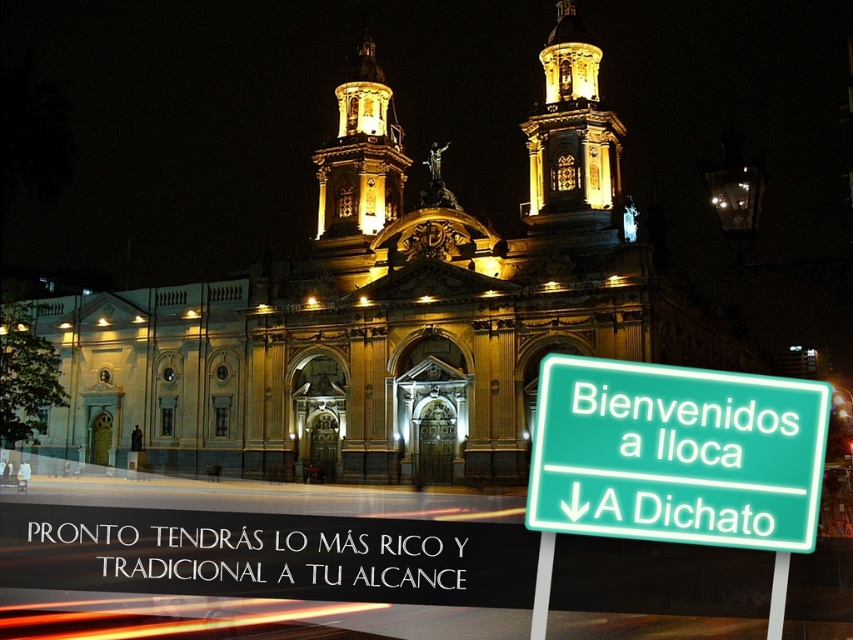
Is green fluorescent sign at lower right thinner than green plastic signpost at lower right?

No, green fluorescent sign at lower right is not thinner than green plastic signpost at lower right.

Which is in front, point (759, 404) or point (538, 552)?

Point (759, 404) is more forward.

Where is `green fluorescent sign at lower right`? green fluorescent sign at lower right is located at coordinates (676, 454).

Can you confirm if green fluorescent sign at lower right is thinner than metallic pole at lower right?

No, green fluorescent sign at lower right is not thinner than metallic pole at lower right.

Which of these two, green fluorescent sign at lower right or metallic pole at lower right, stands taller?

metallic pole at lower right

This screenshot has height=640, width=853. Identify the location of green fluorescent sign at lower right. (676, 454).

Is green plastic signpost at lower right shorter than metallic pole at lower right?

Yes, green plastic signpost at lower right is shorter than metallic pole at lower right.

Which is behind, point (532, 612) or point (775, 627)?

Point (532, 612)

At what (x,y) coordinates should I click in order to perform the action: click on green plastic signpost at lower right. Please return your answer as a coordinate pair (x, y). Image resolution: width=853 pixels, height=640 pixels. Looking at the image, I should click on (543, 586).